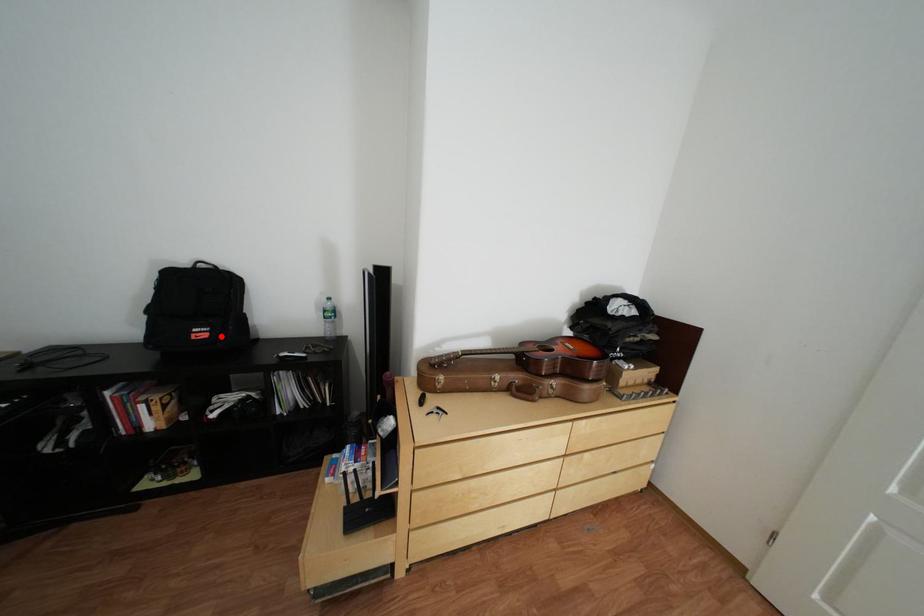
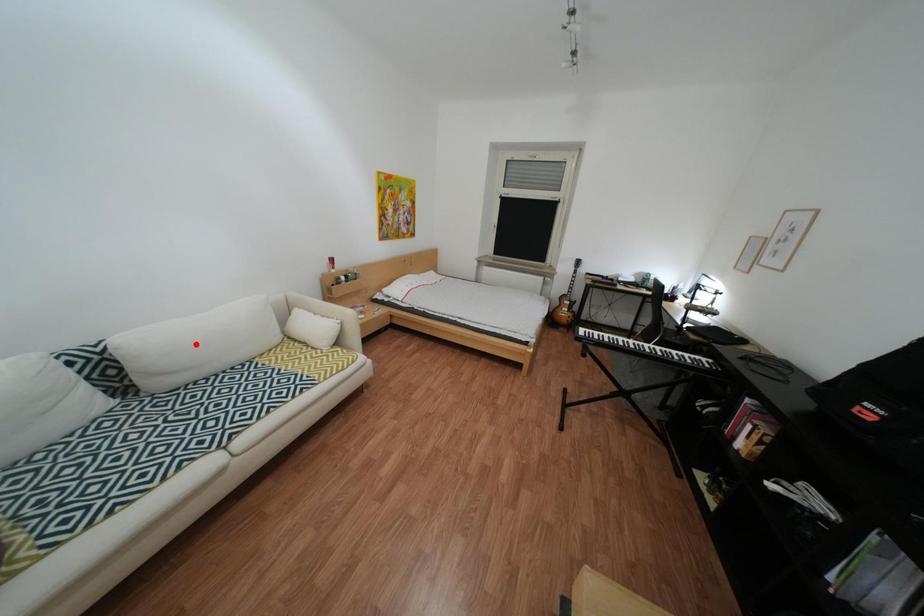
I am providing you with two images of the same scene from different viewpoints. A red point is marked on the first image and another point is marked on the second image. Do the highlighted points in image1 and image2 indicate the same real-world spot?

No